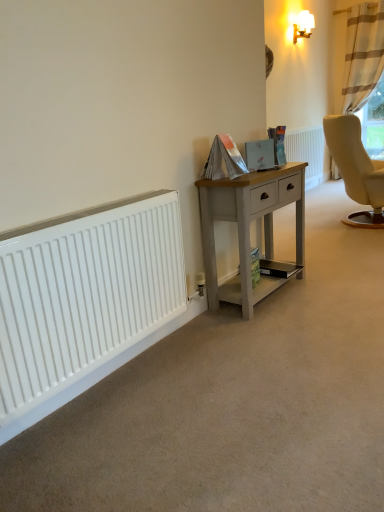
You are a GUI agent. You are given a task and a screenshot of the screen. Output one action in this format:
    pyautogui.click(x=<x>, y=<y>)
    Task: Click on the free area below white smooth radiator at lower left, the first radiator in the left-to-right sequence (from a real-world perspective)
    
    Given the screenshot: What is the action you would take?
    (x=122, y=370)